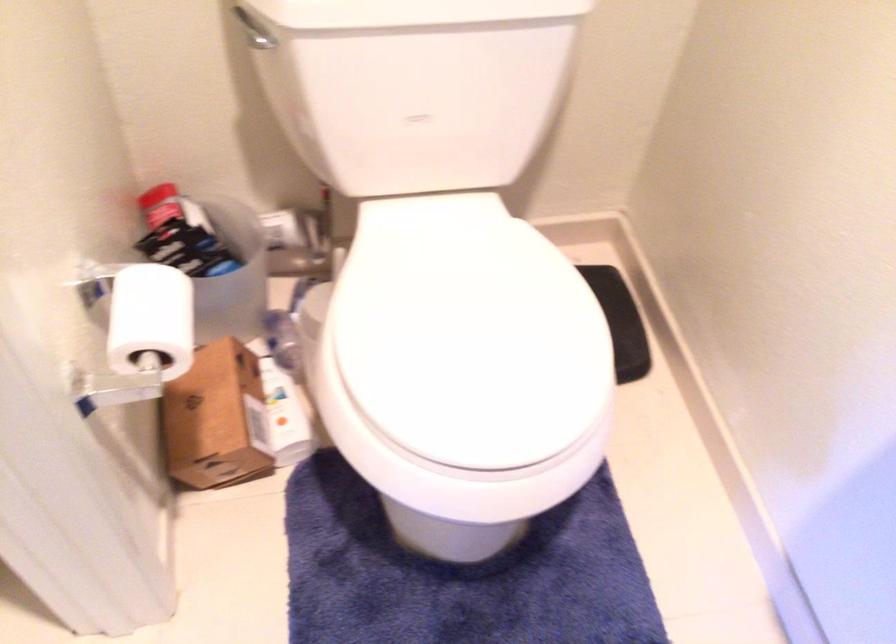
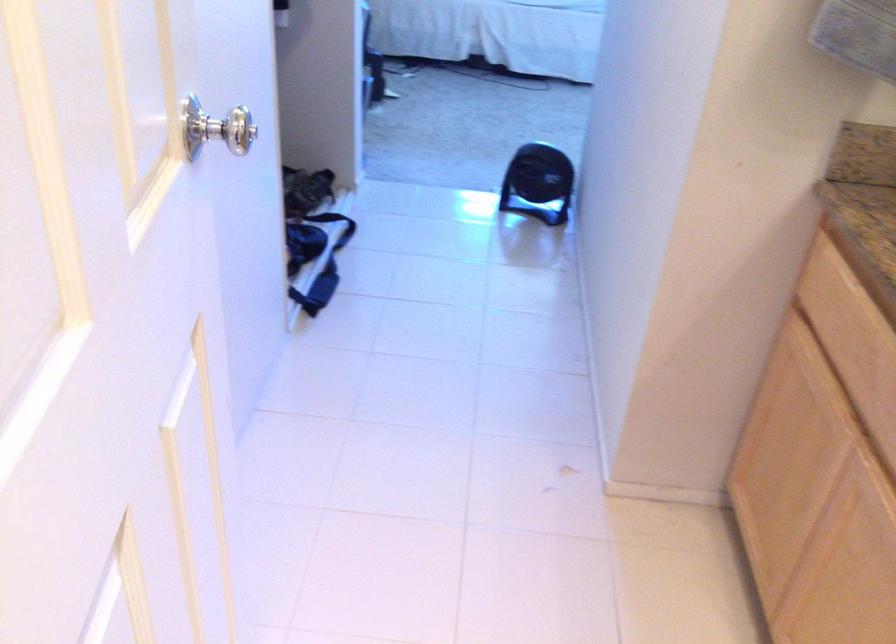
The images are taken continuously from a first-person perspective. In which direction is your viewpoint rotating?

The rotation direction of the camera is left-down.